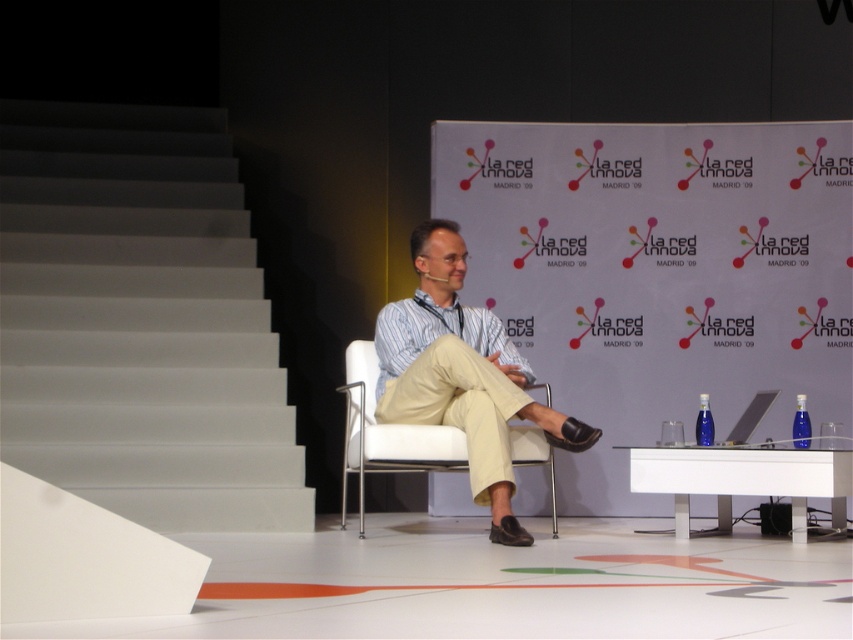
Can you confirm if white smooth stairs at left is positioned above light beige cotton pants at center?

Indeed, white smooth stairs at left is positioned over light beige cotton pants at center.

Is the position of white smooth stairs at left less distant than that of light beige cotton pants at center?

That is False.

Is point (44, 352) positioned after point (505, 353)?

Yes, it is.

Identify the location of white smooth stairs at left. The height and width of the screenshot is (640, 853). (138, 321).

Can you confirm if white smooth stairs at left is smaller than white fabric chair at center?

No.

Can you confirm if white smooth stairs at left is bigger than white fabric chair at center?

Correct, white smooth stairs at left is larger in size than white fabric chair at center.

Locate an element on the screen. The width and height of the screenshot is (853, 640). white smooth stairs at left is located at coordinates (138, 321).

Is light beige cotton pants at center below white fabric chair at center?

Incorrect, light beige cotton pants at center is not positioned below white fabric chair at center.

Does point (445, 273) come farther from viewer compared to point (403, 468)?

Yes, it is.

Locate an element on the screen. This screenshot has height=640, width=853. light beige cotton pants at center is located at coordinates (462, 376).